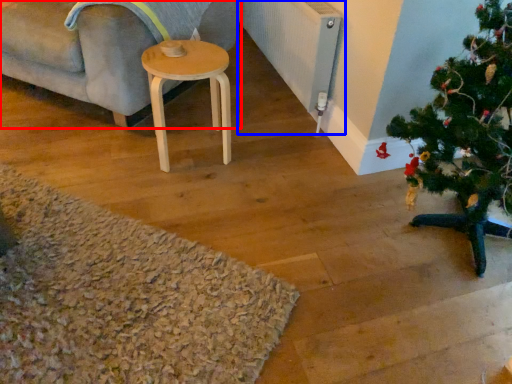
Question: Among these objects, which one is nearest to the camera, studio couch (highlighted by a red box) or radiator (highlighted by a blue box)?

Choices:
 (A) studio couch
 (B) radiator

Answer: (A)